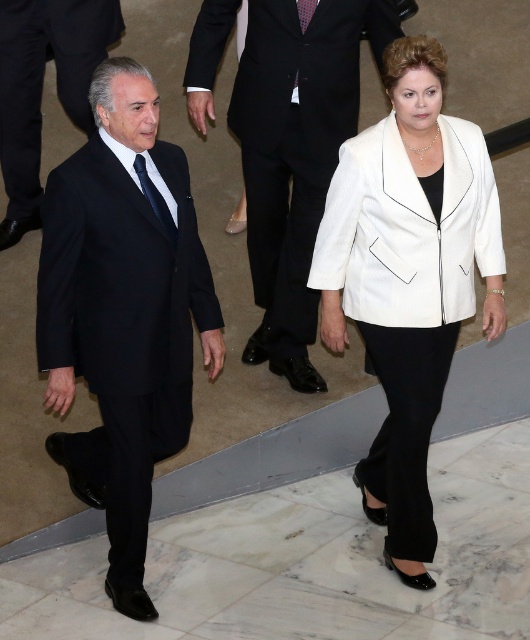
Looking at this image, does black silk suit at left have a greater width compared to dark blue silk tie at left?

Yes.

Who is higher up, black silk suit at left or dark blue silk tie at left?

Positioned higher is dark blue silk tie at left.

What do you see at coordinates (122, 314) in the screenshot? Image resolution: width=530 pixels, height=640 pixels. I see `black silk suit at left` at bounding box center [122, 314].

The height and width of the screenshot is (640, 530). I want to click on black silk suit at left, so click(x=122, y=314).

Can you confirm if black satin suit at left is wider than dark blue silk tie at left?

Yes.

Between black satin suit at left and dark blue silk tie at left, which one is positioned higher?

black satin suit at left is higher up.

Who is more distant from viewer, (66, 20) or (163, 227)?

Positioned behind is point (66, 20).

Where is `black satin suit at left`? The image size is (530, 640). black satin suit at left is located at coordinates (41, 88).

Where is `black silk suit at left`? Image resolution: width=530 pixels, height=640 pixels. black silk suit at left is located at coordinates (122, 314).

Which of these two, black silk suit at left or white leather jacket at center, stands taller?

Standing taller between the two is white leather jacket at center.

You are a GUI agent. You are given a task and a screenshot of the screen. Output one action in this format:
    pyautogui.click(x=<x>, y=<y>)
    Task: Click on the black silk suit at left
    
    Given the screenshot: What is the action you would take?
    pyautogui.click(x=122, y=314)